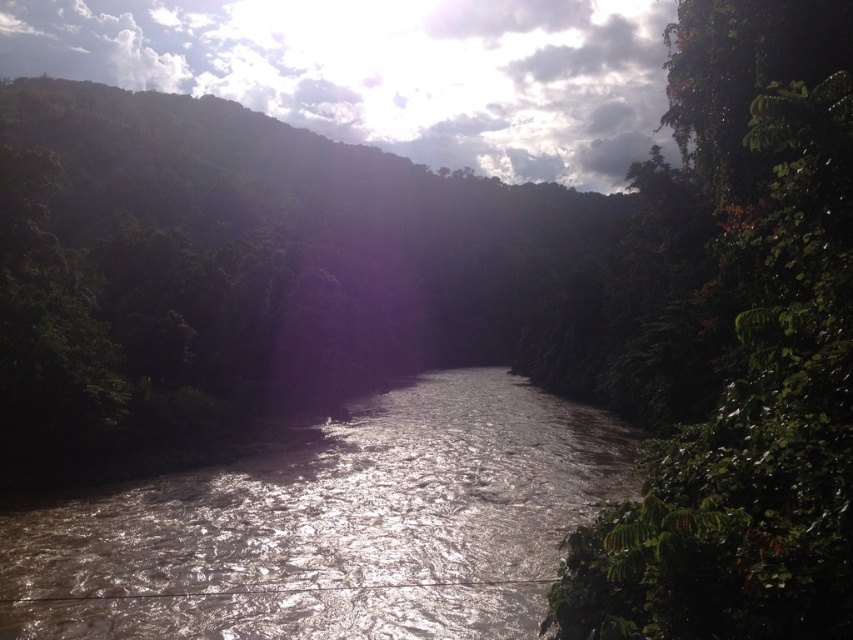
Question: Which object is closer to the camera taking this photo?

Choices:
 (A) green leafy tree at right
 (B) brown/muddy water at center

Answer: (A)

Question: Does green leafy tree at right appear over brown/muddy water at center?

Choices:
 (A) no
 (B) yes

Answer: (B)

Question: Is green leafy tree at right closer to camera compared to brown/muddy water at center?

Choices:
 (A) no
 (B) yes

Answer: (B)

Question: Can you confirm if green leafy tree at right is positioned to the right of brown/muddy water at center?

Choices:
 (A) yes
 (B) no

Answer: (A)

Question: Which of the following is the closest to the observer?

Choices:
 (A) brown/muddy water at center
 (B) green leafy tree at right

Answer: (B)